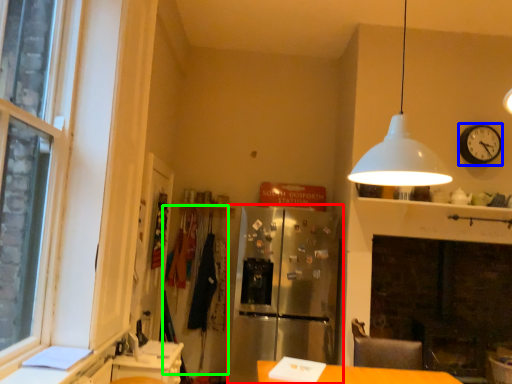
Question: Which object is the closest to the fridge (highlighted by a red box)? Choose among these: clock (highlighted by a blue box) or laundry (highlighted by a green box).

Choices:
 (A) clock
 (B) laundry

Answer: (B)